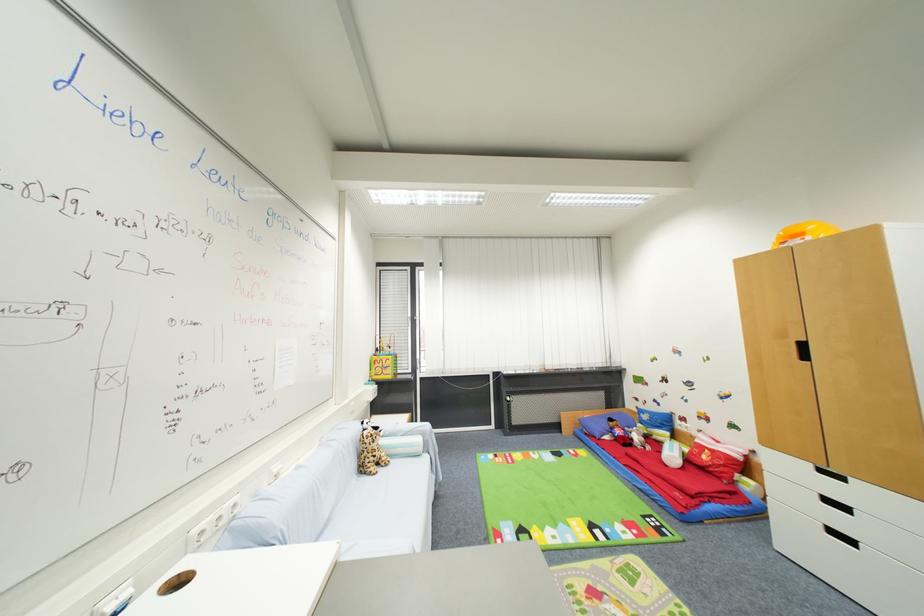
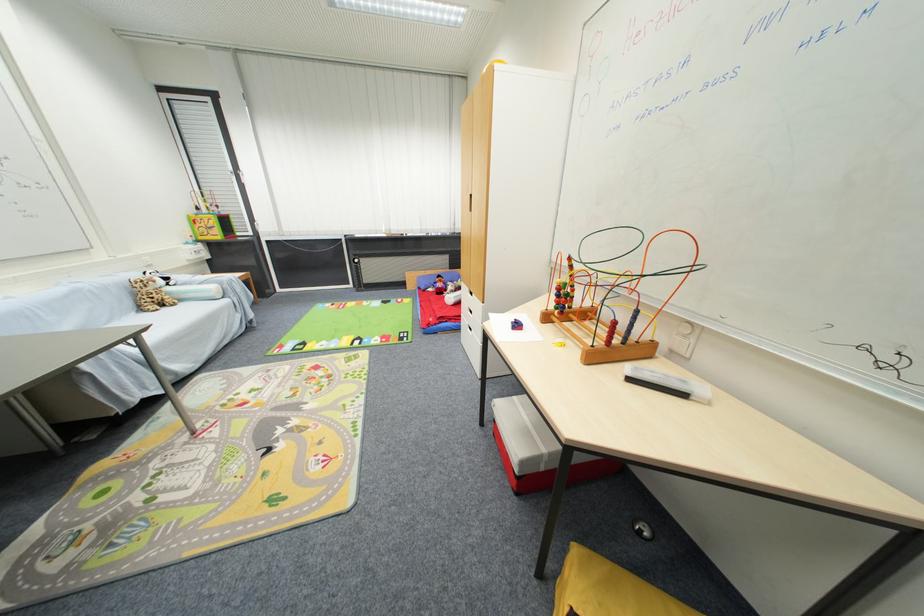
The point at (x=424, y=442) is marked in the first image. Where is the corresponding point in the second image?

(217, 290)